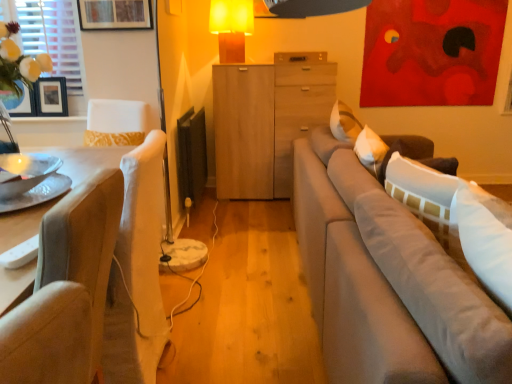
What are the coordinates of `light wood cabinet at center` in the screenshot? It's located at (265, 123).

What is the approximate width of wooden picture frame at upper left, the first picture frame from the right?

The width of wooden picture frame at upper left, the first picture frame from the right, is 1.44 inches.

The height and width of the screenshot is (384, 512). Describe the element at coordinates (84, 245) in the screenshot. I see `textured beige chair at left` at that location.

The height and width of the screenshot is (384, 512). What do you see at coordinates (51, 96) in the screenshot?
I see `black matte picture frame at left, positioned as the 2th picture frame in top-to-bottom order` at bounding box center [51, 96].

At what (x,y) coordinates should I click in order to perform the action: click on light gray fabric couch at right. Please return your answer as a coordinate pair (x, y). The image size is (512, 384). Looking at the image, I should click on (393, 274).

Is light wood cabinet at center far from matte glass vase at left?

light wood cabinet at center is far away from matte glass vase at left.

Is matte glass vase at left completely or partially inside light wood cabinet at center?

Definitely not — matte glass vase at left is not inside light wood cabinet at center.

Between light wood cabinet at center and matte glass vase at left, which one appears on the right side from the viewer's perspective?

Positioned to the right is light wood cabinet at center.

Is light wood cabinet at center oriented towards matte glass vase at left?

No, light wood cabinet at center is not facing towards matte glass vase at left.

Is metallic silver tray at left shorter than black matte picture frame at left, the 1th picture frame when ordered from bottom to top?

Indeed, metallic silver tray at left has a lesser height compared to black matte picture frame at left, the 1th picture frame when ordered from bottom to top.

Does metallic silver tray at left turn towards black matte picture frame at left, the 2th picture frame when ordered from front to back?

No.

Is metallic silver tray at left not within black matte picture frame at left, the 2th picture frame when ordered from front to back?

metallic silver tray at left is positioned outside black matte picture frame at left, the 2th picture frame when ordered from front to back.

Who is shorter, white fabric window screen at upper left or light wood cabinet at center?

Standing shorter between the two is white fabric window screen at upper left.

From the image's perspective, which is below, white fabric window screen at upper left or light wood cabinet at center?

light wood cabinet at center, from the image's perspective.

Between white fabric window screen at upper left and light wood cabinet at center, which one is positioned behind?

Positioned behind is light wood cabinet at center.

Considering the sizes of objects metallic silver tray at left and light gray fabric couch at right in the image provided, who is shorter, metallic silver tray at left or light gray fabric couch at right?

With less height is metallic silver tray at left.

Is metallic silver tray at left smaller than light gray fabric couch at right?

Yes, metallic silver tray at left is smaller than light gray fabric couch at right.

Is metallic silver tray at left oriented towards light gray fabric couch at right?

No.

From the image's perspective, who appears lower, textured beige chair at left or light gray fabric couch at right?

textured beige chair at left, from the image's perspective.

Is textured beige chair at left situated inside light gray fabric couch at right or outside?

textured beige chair at left is not inside light gray fabric couch at right, it's outside.

Where is `studio couch located above the textured beige chair at left (from the image's perspective)`? studio couch located above the textured beige chair at left (from the image's perspective) is located at coordinates (393, 274).

Between textured beige chair at left and light gray fabric couch at right, which one has more height?

Standing taller between the two is textured beige chair at left.

Which is more to the right, metallic silver tray at left or wooden picture frame at upper left, the second picture frame when ordered from left to right?

Positioned to the right is metallic silver tray at left.

Is wooden picture frame at upper left, which is counted as the 1th picture frame, starting from the top, located within metallic silver tray at left?

Definitely not — wooden picture frame at upper left, which is counted as the 1th picture frame, starting from the top, is not inside metallic silver tray at left.

Considering the positions of points (21, 159) and (93, 25), is point (21, 159) farther from camera compared to point (93, 25)?

No, (21, 159) is closer to viewer.

From a real-world perspective, is metallic silver tray at left positioned above or below wooden picture frame at upper left, which appears as the second picture frame when viewed from the back?

Clearly, from a real-world perspective, metallic silver tray at left is below wooden picture frame at upper left, which appears as the second picture frame when viewed from the back.

Can you confirm if matte glass vase at left is bigger than metallic silver tray at left?

No, matte glass vase at left is not bigger than metallic silver tray at left.

Is matte glass vase at left turned away from metallic silver tray at left?

matte glass vase at left does not have its back to metallic silver tray at left.

In the scene shown: Is matte glass vase at left positioned in front of metallic silver tray at left?

No, the depth of matte glass vase at left is greater than that of metallic silver tray at left.

Would you say matte glass vase at left is outside metallic silver tray at left?

Absolutely, matte glass vase at left is external to metallic silver tray at left.

Locate an element on the screen. The height and width of the screenshot is (384, 512). vase on the left of the light wood cabinet at center is located at coordinates (19, 101).

From the image's perspective, which picture frame is the 1st one above the metallic silver tray at left? Please provide its 2D coordinates.

[(51, 96)]

Looking at the image, which one is located closer to wooden picture frame at upper left, which is counted as the 1th picture frame, starting from the top, light wood cabinet at center or matte glass vase at left?

matte glass vase at left is closer to wooden picture frame at upper left, which is counted as the 1th picture frame, starting from the top.

Which object lies nearer to the anchor point metallic silver tray at left, matte glass vase at left or wooden drawer at center?

matte glass vase at left.

Looking at this image, when comparing their distances from matte glass vase at left, does wooden picture frame at upper left, placed as the second picture frame when sorted from bottom to top, or white fabric window screen at upper left seem further?

Based on the image, wooden picture frame at upper left, placed as the second picture frame when sorted from bottom to top, appears to be further to matte glass vase at left.

Considering their positions, is matte glass vase at left positioned further to matte orange lampshade at upper center than black matte picture frame at left, positioned as the 2th picture frame in top-to-bottom order?

The object further to matte orange lampshade at upper center is matte glass vase at left.

Looking at the image, which one is located closer to wooden picture frame at upper left, the 1th picture frame when ordered from front to back, matte glass vase at left or textured beige chair at left?

matte glass vase at left is closer to wooden picture frame at upper left, the 1th picture frame when ordered from front to back.

When comparing their distances from metallic silver tray at left, does wooden picture frame at upper left, which appears as the second picture frame when viewed from the back, or light wood cabinet at center seem closer?

wooden picture frame at upper left, which appears as the second picture frame when viewed from the back.

Based on their spatial positions, is matte glass vase at left or matte orange lampshade at upper center further from metallic silver tray at left?

matte orange lampshade at upper center lies further to metallic silver tray at left than the other object.

From the image, which object appears to be nearer to wooden drawer at center, white fabric window screen at upper left or wooden picture frame at upper left, the second picture frame when ordered from left to right?

Based on the image, wooden picture frame at upper left, the second picture frame when ordered from left to right, appears to be nearer to wooden drawer at center.

At what (x,y) coordinates should I click in order to perform the action: click on round table positioned between light gray fabric couch at right and wooden drawer at center from near to far. Please return your answer as a coordinate pair (x, y). Looking at the image, I should click on (31, 181).

Locate an element on the screen. picture frame positioned between metallic silver tray at left and matte glass vase at left from near to far is located at coordinates (115, 14).

Identify the location of picture frame between white fabric window screen at upper left and wooden picture frame at upper left, placed as the second picture frame when sorted from bottom to top, in the horizontal direction. The image size is (512, 384). (51, 96).

The width and height of the screenshot is (512, 384). Identify the location of window screen situated between matte glass vase at left and wooden drawer at center from left to right. (52, 41).